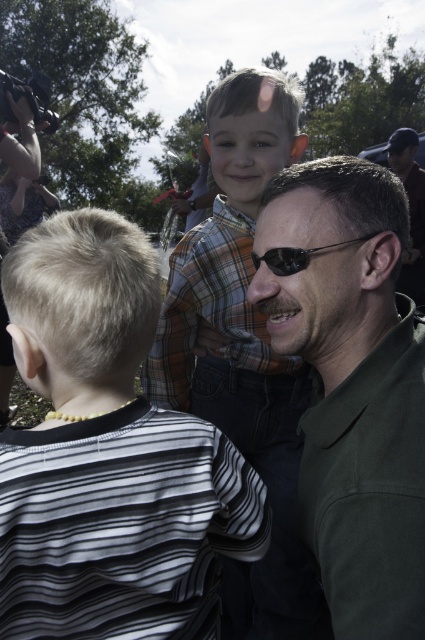
You are a photographer trying to capture a candid shot of the black striped shirt at left and the green matte shirt at center. Based on their heights, which one should you focus on first to ensure both are in frame without needing to adjust your camera angle?

The black striped shirt at left is taller than the green matte shirt at center, so focusing on the taller black striped shirt at left first will ensure the shorter green matte shirt at center remains in frame without needing to adjust the camera angle.

You are a photographer trying to capture a candid shot of the black striped shirt at left and the black plastic sunglasses at center. Based on their positions, which object is closer to the camera?

The black striped shirt at left is positioned under the black plastic sunglasses at center, meaning the sunglasses are closer to the camera.

You are a photographer trying to capture a closeup of the green matte shirt at center without the black plastic sunglasses at center blocking the view. Based on their positions, can you achieve this?

Yes, because the green matte shirt at center is in front of the black plastic sunglasses at center, so the shirt will block the sunglasses from view, allowing you to take a closeup of the shirt without the sunglasses obstructing it.